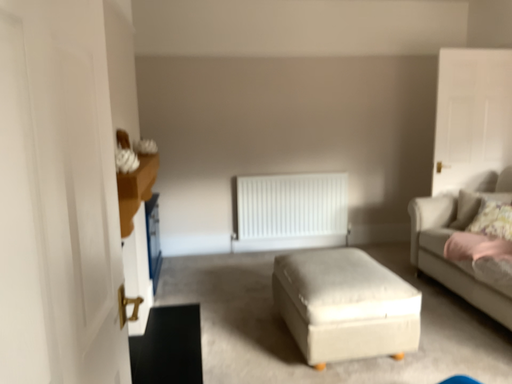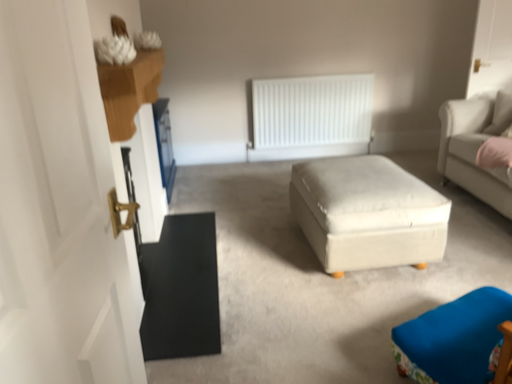
Question: How did the camera likely rotate when shooting the video?

Choices:
 (A) rotated upward
 (B) rotated downward

Answer: (B)